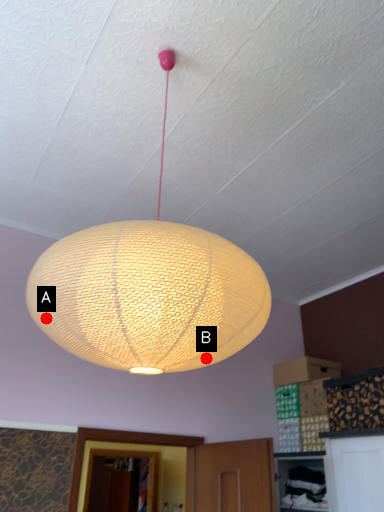
Question: Two points are circled on the image, labeled by A and B beside each circle. Which point is further to the camera?

Choices:
 (A) A is further
 (B) B is further

Answer: (B)